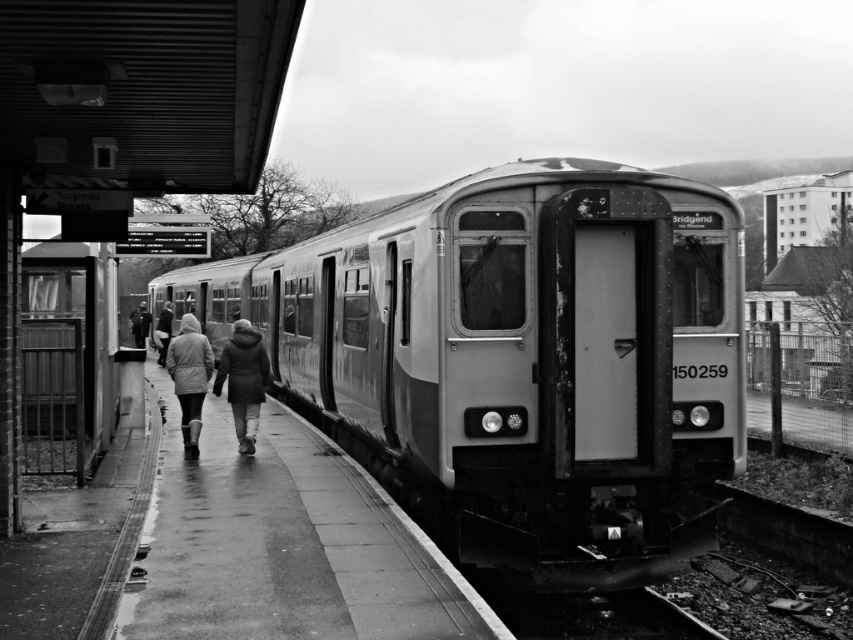
Is concrete platform at center thinner than matte gray coat at center?

In fact, concrete platform at center might be wider than matte gray coat at center.

Locate an element on the screen. The width and height of the screenshot is (853, 640). concrete platform at center is located at coordinates (285, 545).

The height and width of the screenshot is (640, 853). In order to click on concrete platform at center in this screenshot , I will do `click(285, 545)`.

Can you confirm if concrete platform at center is positioned to the left of dark gray jacket at center?

No, concrete platform at center is not to the left of dark gray jacket at center.

Measure the distance between concrete platform at center and camera.

concrete platform at center is 5.17 meters from camera.

Is point (273, 572) less distant than point (242, 340)?

Yes, it is.

What are the coordinates of `concrete platform at center` in the screenshot? It's located at (285, 545).

Does metallic gray train at center appear under dark gray coat at center?

No.

Is metallic gray train at center positioned before dark gray coat at center?

Yes, metallic gray train at center is closer to the viewer.

I want to click on metallic gray train at center, so click(520, 358).